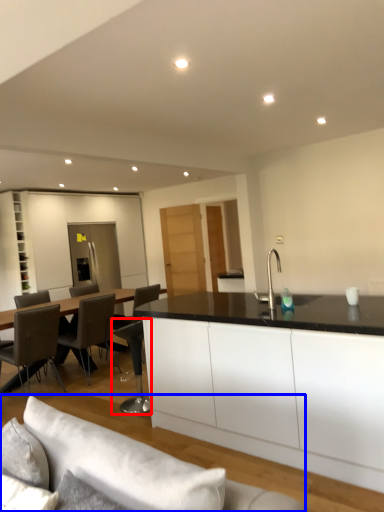
Question: Which object is further to the camera taking this photo, chair (highlighted by a red box) or studio couch (highlighted by a blue box)?

Choices:
 (A) chair
 (B) studio couch

Answer: (A)